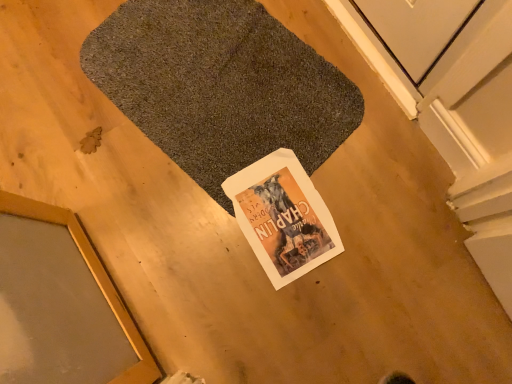
This screenshot has height=384, width=512. In order to click on vacant space underneath dark gray carpet at center (from a real-world perspective) in this screenshot , I will do `click(225, 84)`.